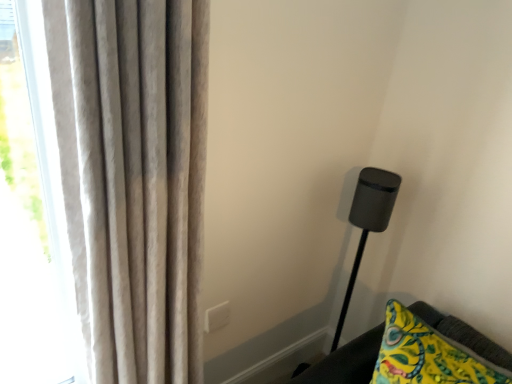
What do you see at coordinates (133, 178) in the screenshot? I see `satin beige curtains at left` at bounding box center [133, 178].

Where is `satin beige curtains at left`? The height and width of the screenshot is (384, 512). satin beige curtains at left is located at coordinates (133, 178).

The image size is (512, 384). Find the location of `satin beige curtains at left`. satin beige curtains at left is located at coordinates (133, 178).